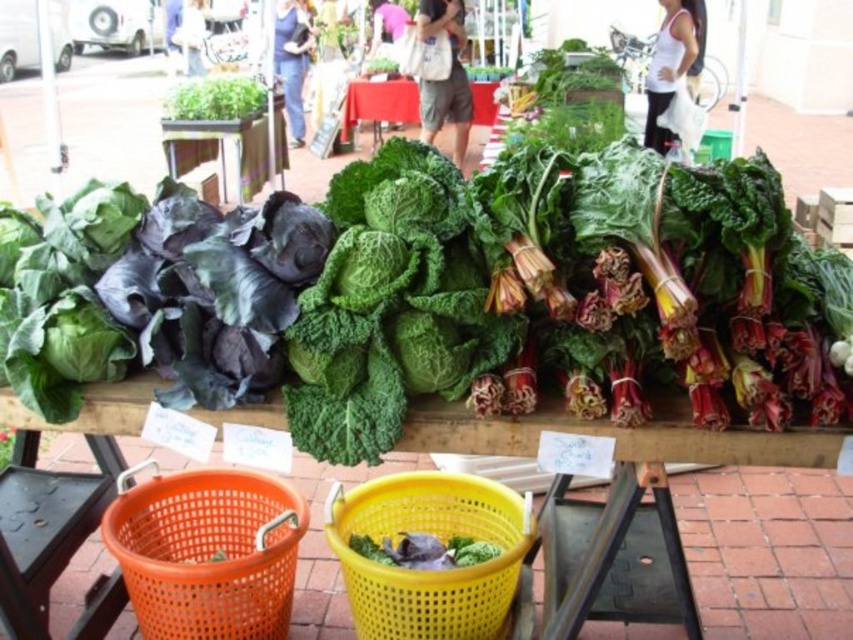
You are standing in front of the vegetable display and want to pick up both items at point (345, 140) and point (433, 538). Which item should you reach for first to minimize bending?

You should reach for the item at point (345, 140) first because it is closer to you than the item at point (433, 538), so you won

You are a customer at the farmer market standing in front of the wooden table at center. You want to pick up a head of purple cabbage located on the left side of the table. Can you reach it without moving closer to the table?

The wooden table at center is 1.16 meters away from you. Since the average arm length is about 0.7 meters, you cannot reach the purple cabbage on the left side of the wooden table at center without moving closer.

You are a customer at the farmer market and want to buy the green leafy vegetable at center. The vendor says you can only buy it if it is larger than the wooden table at center. Can you buy it?

The green leafy vegetable at center is larger than the wooden table at center, so yes, you can buy it.